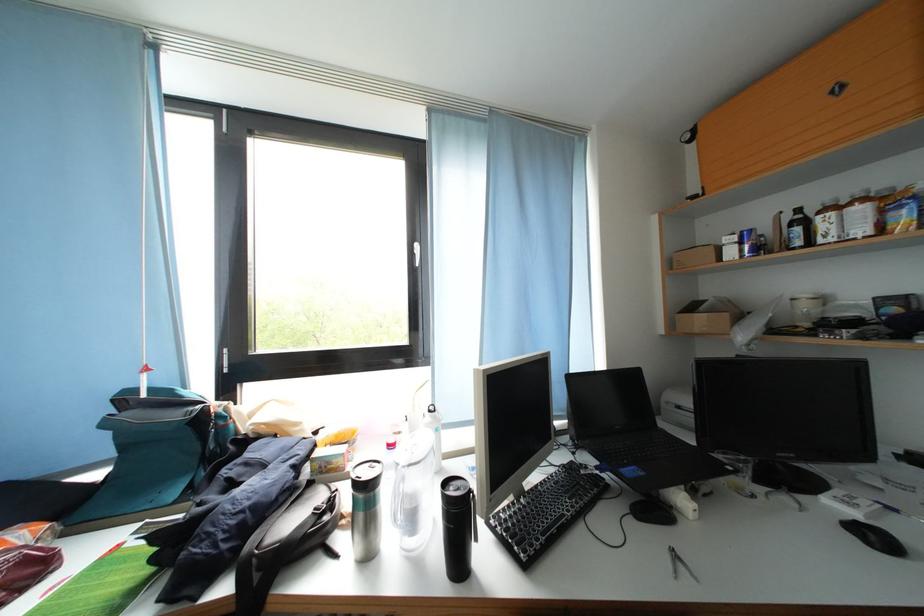
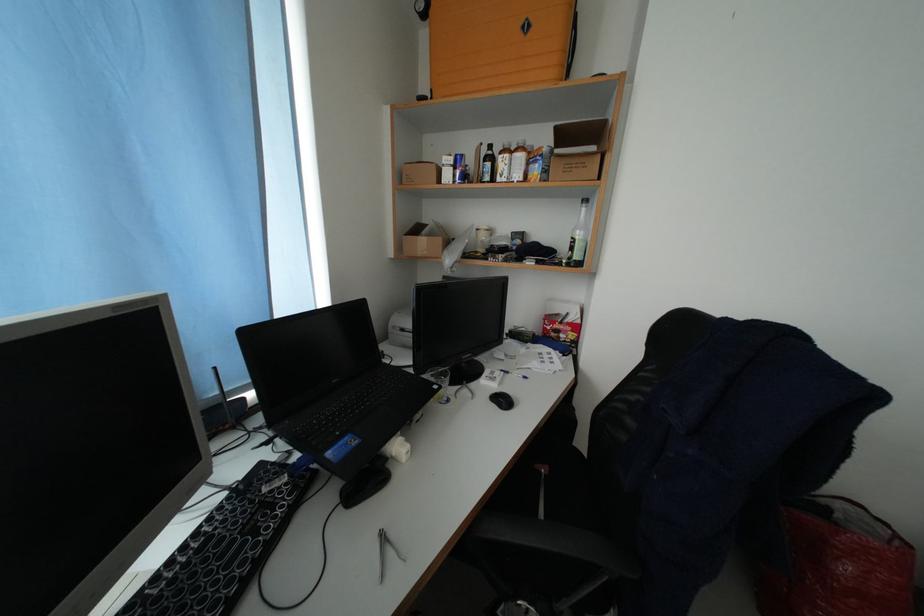
Question: Based on the continuous images, in which direction is the camera rotating? Reply with the corresponding letter.

Choices:
 (A) Left
 (B) Right
 (C) Up
 (D) Down

Answer: (B)